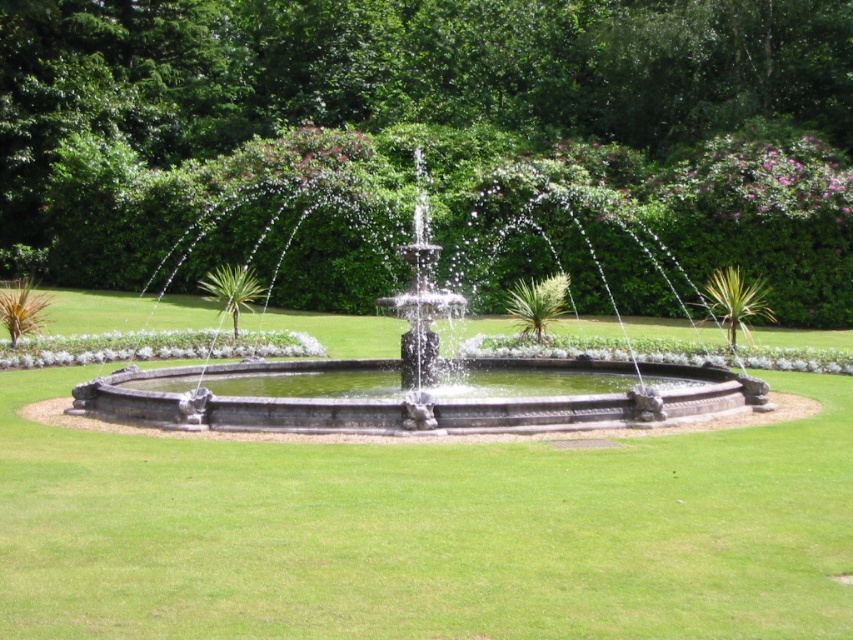
From the picture: You are standing in the garden and want to walk from the stone fountain at center to the green grass at center. Which direction should you face before stepping forward?

You should face to the right because the green grass at center is located to the right of the stone fountain at center.

You are standing in the garden and want to place a small bench between the green leafy tree at center and the green grass at center. Since the bench is 1 meter wide, can you fit it there?

The green leafy tree at center is located above the green grass at center, so there is no horizontal space between them. The bench cannot be placed between them as they are vertically aligned.

You are standing in the garden looking at the fountain. There are two points marked in the scene, one at point coordinates point [717,108] and another at point coordinates point [614,561]. Which point is closer to you?

Point [717,108] is further to the camera than point [614,561], so the point closer to you is point [614,561].